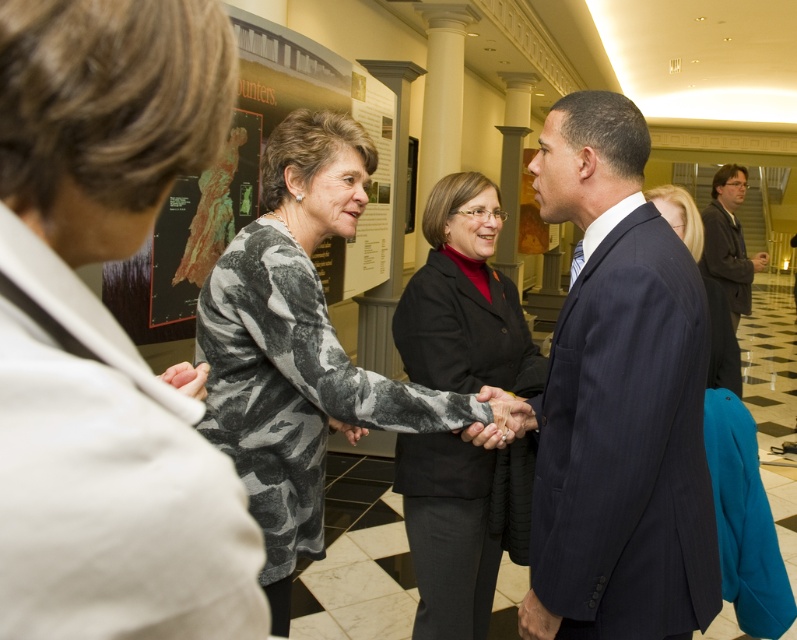
Question: Is the position of camouflage-patterned dress at center more distant than that of dark gray suit at right?

Choices:
 (A) no
 (B) yes

Answer: (A)

Question: Does dark blue pinstripe suit at center appear over black wool coat at center?

Choices:
 (A) yes
 (B) no

Answer: (B)

Question: Which of the following is the farthest from the observer?

Choices:
 (A) pos(760,262)
 (B) pos(729,380)
 (C) pos(476,316)

Answer: (A)

Question: Can you confirm if camouflage-patterned dress at center is positioned to the left of black matte blazer at center?

Choices:
 (A) no
 (B) yes

Answer: (B)

Question: Which of these objects is positioned farthest from the camouflage-patterned dress at center?

Choices:
 (A) dark blue pinstripe suit at center
 (B) black wool coat at center

Answer: (B)

Question: Which point is farther from the camera taking this photo?

Choices:
 (A) (737, 300)
 (B) (562, 163)
 (C) (662, 212)

Answer: (A)